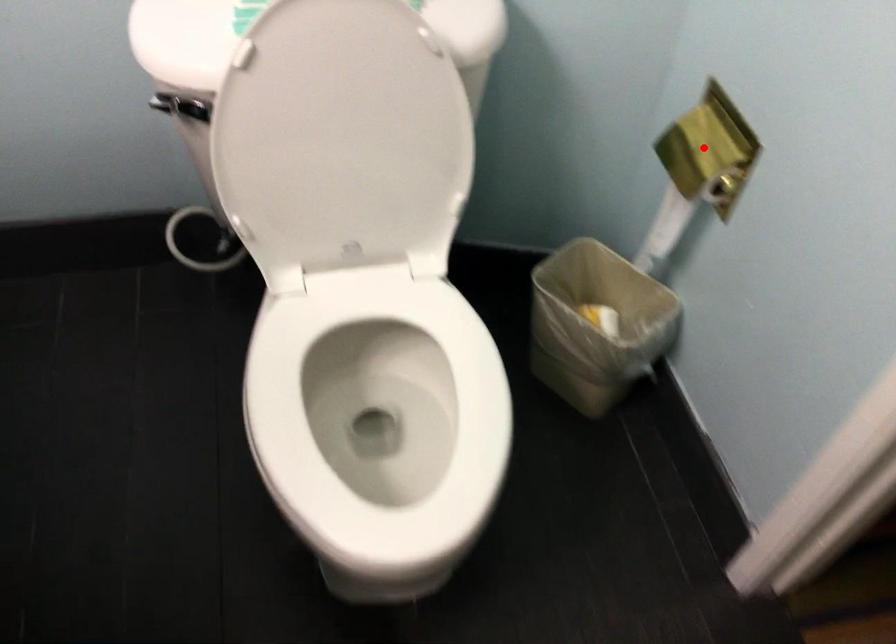
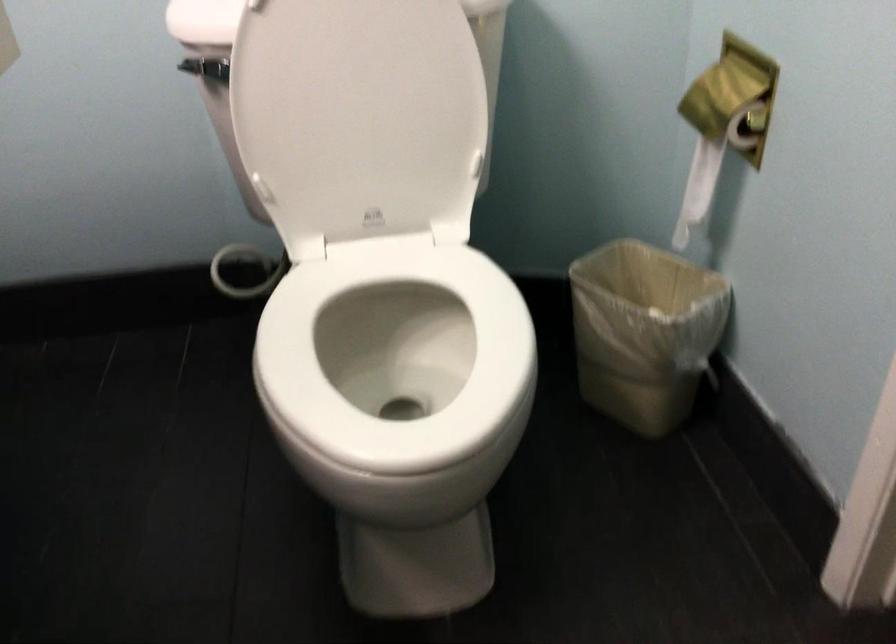
Find the pixel in the second image that matches the highlighted location in the first image.

(722, 91)